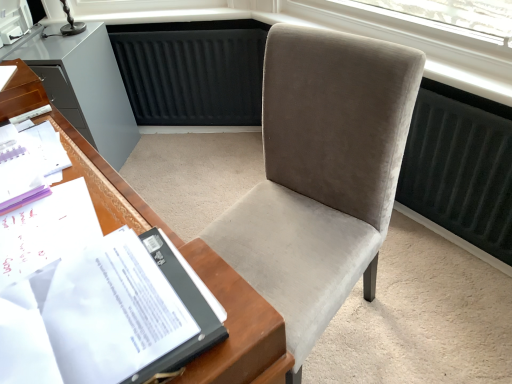
Identify the location of vacant region above matte gray cabinet at left (from a real-world perspective). This screenshot has width=512, height=384. (67, 46).